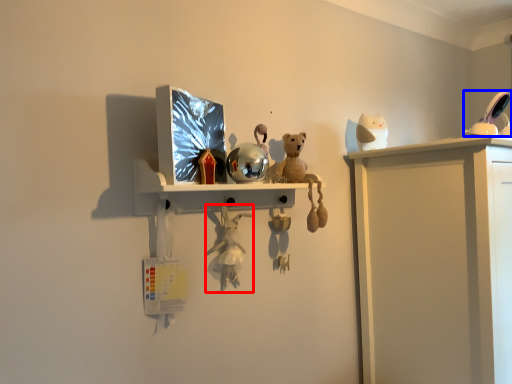
Question: Which object appears farthest to the camera in this image, toy (highlighted by a red box) or toy (highlighted by a blue box)?

Choices:
 (A) toy
 (B) toy

Answer: (B)